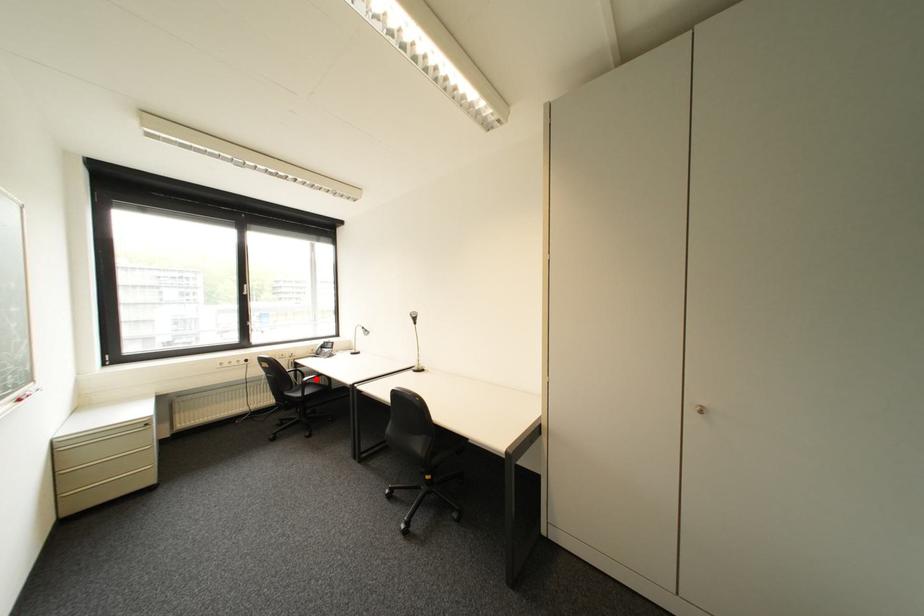
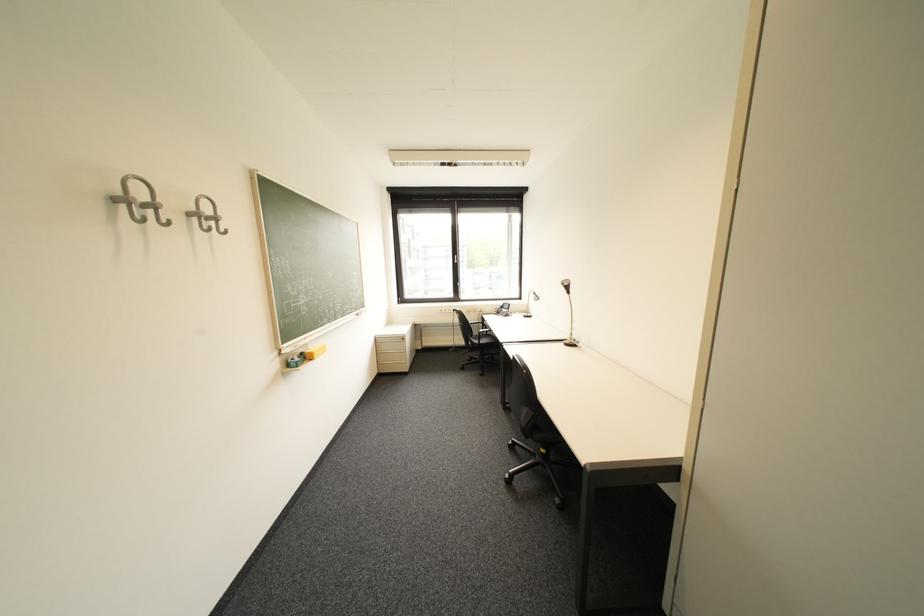
Question: I am providing you with two images of the same scene from different viewpoints. A red point is shown in image1. For the corresponding object point in image2, is it positioned nearer or farther from the camera?

Choices:
 (A) Nearer
 (B) Farther

Answer: (A)